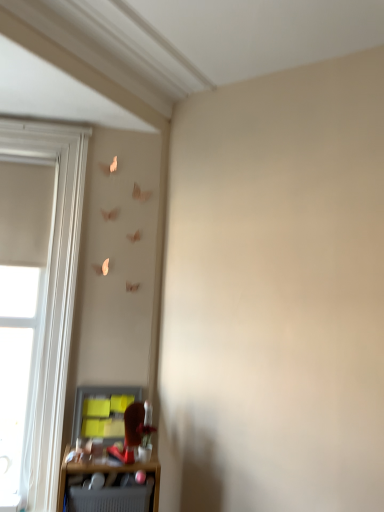
I want to click on matte gray cabinet at lower left, so click(102, 411).

Locate an element on the screen. white wood window at left is located at coordinates (51, 295).

This screenshot has height=512, width=384. Identify the location of matte gray shelf at lower left. (108, 485).

Identify the location of matte gray cabinet at lower left. This screenshot has height=512, width=384. point(102,411).

Would you say white wood window at left is outside matte gray cabinet at lower left?

Yes, white wood window at left is outside of matte gray cabinet at lower left.

The width and height of the screenshot is (384, 512). Identify the location of window above the matte gray cabinet at lower left (from the image's perspective). (51, 295).

From the image's perspective, is white wood window at left on top of matte gray cabinet at lower left?

Indeed, from the image's perspective, white wood window at left is shown above matte gray cabinet at lower left.

This screenshot has width=384, height=512. Find the location of `window that is above the matte gray shelf at lower left (from the image's perspective)`. window that is above the matte gray shelf at lower left (from the image's perspective) is located at coordinates (51, 295).

Between matte gray shelf at lower left and white wood window at left, which one is positioned in front?

matte gray shelf at lower left is in front.

Can you confirm if matte gray shelf at lower left is smaller than white wood window at left?

Yes, matte gray shelf at lower left is smaller than white wood window at left.

Are matte gray cabinet at lower left and matte gray shelf at lower left making contact?

matte gray cabinet at lower left is not next to matte gray shelf at lower left, and they're not touching.

Can you confirm if matte gray cabinet at lower left is taller than matte gray shelf at lower left?

Correct, matte gray cabinet at lower left is much taller as matte gray shelf at lower left.

Measure the distance between matte gray cabinet at lower left and matte gray shelf at lower left.

28.32 centimeters.

Is matte gray cabinet at lower left with white wood window at left?

No, matte gray cabinet at lower left is not next to white wood window at left.

Identify the location of window above the matte gray cabinet at lower left (from a real-world perspective). (51, 295).

Can you confirm if matte gray cabinet at lower left is shorter than white wood window at left?

Yes.

Is matte gray cabinet at lower left turned away from white wood window at left?

No, matte gray cabinet at lower left's orientation is not away from white wood window at left.

Consider the image. From a real-world perspective, which object rests below the other?

matte gray shelf at lower left is physically lower.

Locate an element on the screen. cabinet that appears above the matte gray shelf at lower left (from a real-world perspective) is located at coordinates (102, 411).

Could you tell me if matte gray shelf at lower left is turned towards matte gray cabinet at lower left?

No, matte gray shelf at lower left is not turned towards matte gray cabinet at lower left.

Is matte gray shelf at lower left to the left of matte gray cabinet at lower left from the viewer's perspective?

Incorrect, matte gray shelf at lower left is not on the left side of matte gray cabinet at lower left.

Could you tell me if white wood window at left is turned towards matte gray shelf at lower left?

No, white wood window at left is not turned towards matte gray shelf at lower left.

From a real-world perspective, is white wood window at left above or below matte gray shelf at lower left?

In terms of real-world spatial position, white wood window at left is above matte gray shelf at lower left.

Is point (36, 421) positioned before point (113, 466)?

No, it is behind (113, 466).

Is white wood window at left touching matte gray shelf at lower left?

No, white wood window at left is not in contact with matte gray shelf at lower left.

What are the coordinates of `cabinet behind the white wood window at left` in the screenshot? It's located at (102, 411).

The height and width of the screenshot is (512, 384). Identify the location of shelf beneath the white wood window at left (from a real-world perspective). (108, 485).

When comparing their distances from matte gray shelf at lower left, does white wood window at left or matte gray cabinet at lower left seem closer?

matte gray cabinet at lower left lies closer to matte gray shelf at lower left than the other object.

Based on their spatial positions, is matte gray shelf at lower left or matte gray cabinet at lower left further from white wood window at left?

Based on the image, matte gray shelf at lower left appears to be further to white wood window at left.

Considering their positions, is white wood window at left positioned further to matte gray cabinet at lower left than matte gray shelf at lower left?

white wood window at left lies further to matte gray cabinet at lower left than the other object.

Which object lies further to the anchor point white wood window at left, matte gray cabinet at lower left or matte gray shelf at lower left?

matte gray shelf at lower left.

Which object lies nearer to the anchor point matte gray cabinet at lower left, matte gray shelf at lower left or white wood window at left?

matte gray shelf at lower left is closer to matte gray cabinet at lower left.

Based on their spatial positions, is matte gray cabinet at lower left or white wood window at left closer to matte gray shelf at lower left?

matte gray cabinet at lower left lies closer to matte gray shelf at lower left than the other object.

Find the location of a particular element. cabinet that lies between white wood window at left and matte gray shelf at lower left from top to bottom is located at coordinates (102, 411).